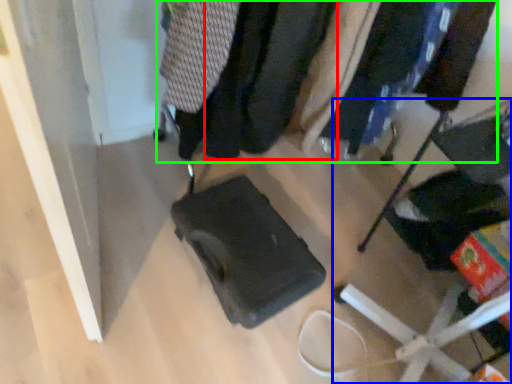
Question: Which is nearer to the clothing (highlighted by a red box)? furniture (highlighted by a blue box) or closet (highlighted by a green box).

Choices:
 (A) furniture
 (B) closet

Answer: (B)